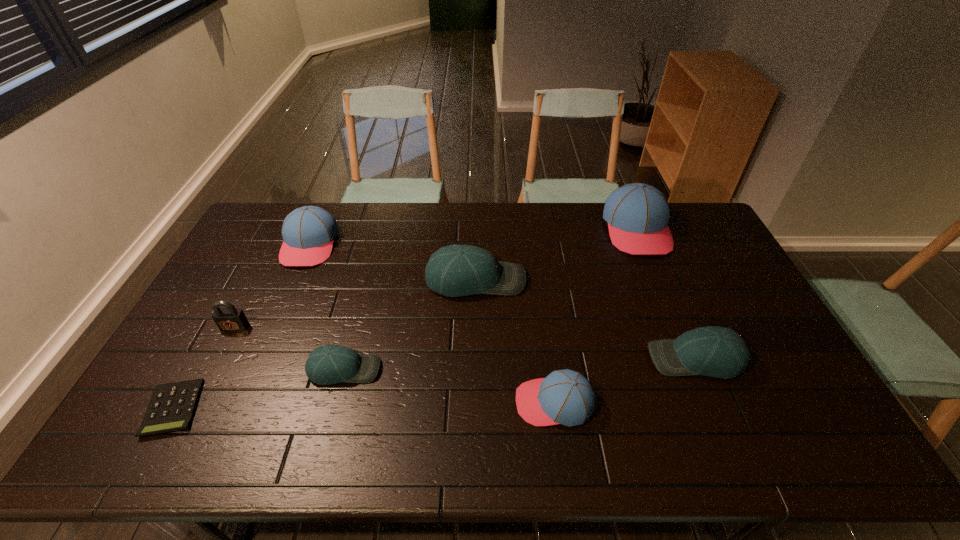
Locate an element on the screen. The image size is (960, 540). the tallest baseball cap is located at coordinates (638, 214).

You are a GUI agent. You are given a task and a screenshot of the screen. Output one action in this format:
    pyautogui.click(x=<x>, y=<y>)
    Task: Click on the tallest object
    The height and width of the screenshot is (540, 960).
    Given the screenshot: What is the action you would take?
    pyautogui.click(x=638, y=214)

Locate an element on the screen. The height and width of the screenshot is (540, 960). the leftmost baseball cap is located at coordinates (308, 232).

Locate an element on the screen. the second biggest blue baseball cap is located at coordinates (308, 232).

Locate an element on the screen. This screenshot has width=960, height=540. the biggest light baseball cap is located at coordinates (456, 270).

You are a GUI agent. You are given a task and a screenshot of the screen. Output one action in this format:
    pyautogui.click(x=<x>, y=<y>)
    Task: Click on the second light baseball cap from left to right
    
    Given the screenshot: What is the action you would take?
    pyautogui.click(x=456, y=270)

At what (x,y) coordinates should I click in order to perform the action: click on padlock. Please return your answer as a coordinate pair (x, y). Image resolution: width=960 pixels, height=540 pixels. Looking at the image, I should click on (230, 319).

Find the location of a particular element. This screenshot has height=540, width=960. the fifth nearest object is located at coordinates point(230,319).

The width and height of the screenshot is (960, 540). In order to click on the rightmost light baseball cap in this screenshot , I will do `click(714, 351)`.

Identify the location of the second blue baseball cap from right to left. This screenshot has height=540, width=960. (566, 397).